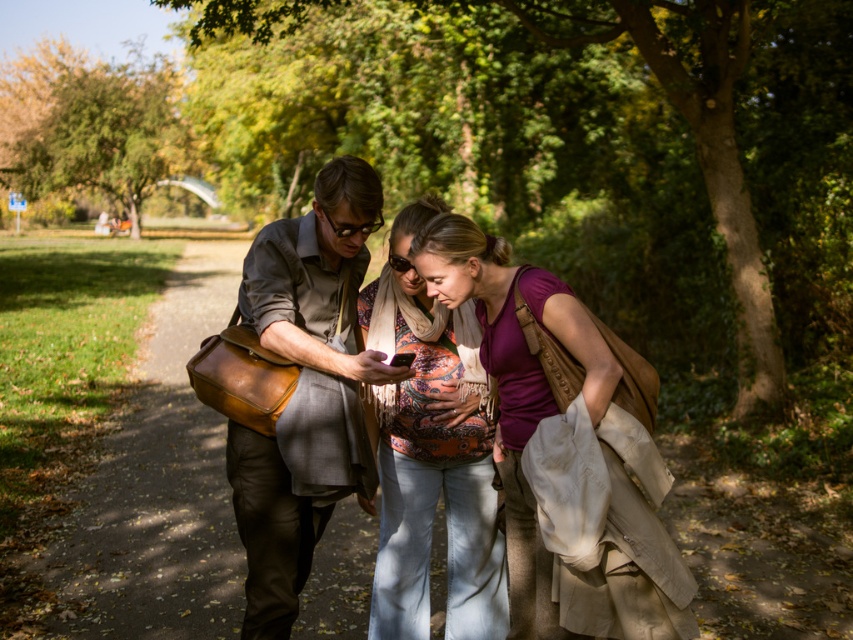
You are trying to decide whether to place a small decorative item on either the matte brown leather bag at center or the matte orange scarf at center. Which surface would allow the item to be more visible to someone standing in front of them?

The matte orange scarf at center is taller than the matte brown leather bag at center, so placing the item on the matte orange scarf at center would make it more visible to someone standing in front of them.

You are a delivery person trying to find the person with the matte brown leather bag at center in the park. The park map shows coordinates where the bag is at point [305,388]. If you are currently at point 0.5, 0.5, which direction should you move to reach the bag?

The matte brown leather bag at center is located at point [305,388]. Since you are at point 0.5, 0.5, you should move northeast to reach the bag.

You are a fashion designer observing the group in the park. You notice the purple cotton shirt at center and the matte orange scarf at center. Which clothing item is smaller in size?

The purple cotton shirt at center has a smaller size compared to the matte orange scarf at center.